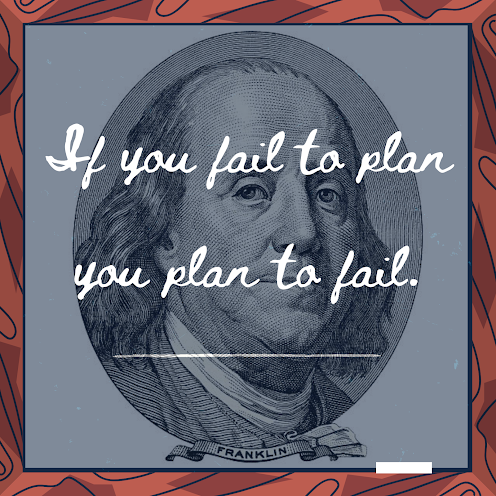
Where is `frame`? This screenshot has width=496, height=496. frame is located at coordinates (8, 487).